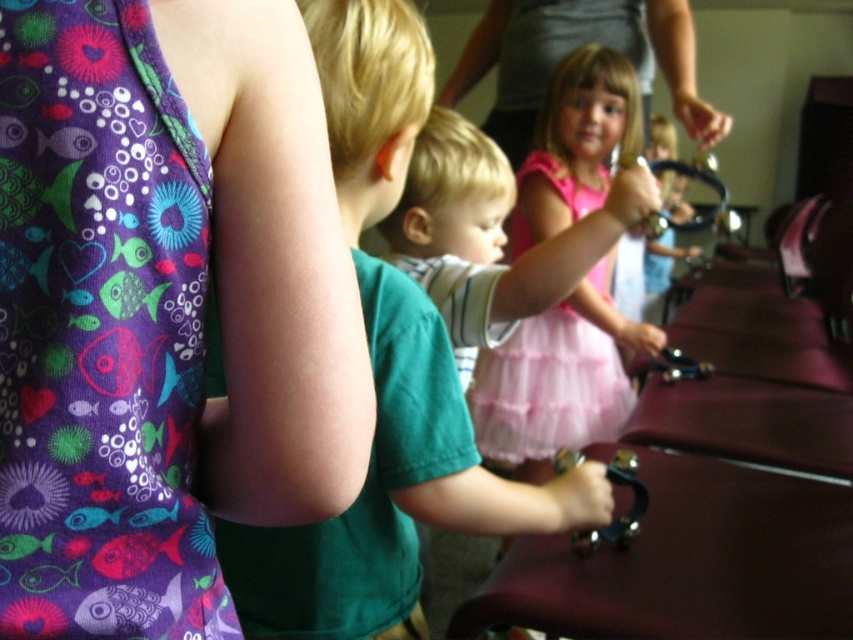
Does purple fabric dress at left have a lesser width compared to green matte shirt at center?

Indeed, purple fabric dress at left has a lesser width compared to green matte shirt at center.

Can you confirm if purple fabric dress at left is positioned above green matte shirt at center?

Incorrect, purple fabric dress at left is not positioned above green matte shirt at center.

You are a GUI agent. You are given a task and a screenshot of the screen. Output one action in this format:
    pyautogui.click(x=<x>, y=<y>)
    Task: Click on the purple fabric dress at left
    This screenshot has height=640, width=853.
    Given the screenshot: What is the action you would take?
    pyautogui.click(x=100, y=332)

Can you confirm if pink tulle dress at center is smaller than pink tulle skirt at center?

Yes, pink tulle dress at center is smaller than pink tulle skirt at center.

Who is more forward, (527,388) or (526,92)?

Positioned in front is point (527,388).

Is point (550, 387) more distant than point (543, 67)?

That is False.

Where is `pink tulle dress at center`? This screenshot has width=853, height=640. pink tulle dress at center is located at coordinates (548, 388).

Consider the image. Which of these two, purple fabric dress at left or pink tulle dress at center, stands shorter?

purple fabric dress at left

Does purple fabric dress at left appear over pink tulle dress at center?

No, purple fabric dress at left is not above pink tulle dress at center.

Locate an element on the screen. purple fabric dress at left is located at coordinates (100, 332).

Identify the location of purple fabric dress at left. (100, 332).